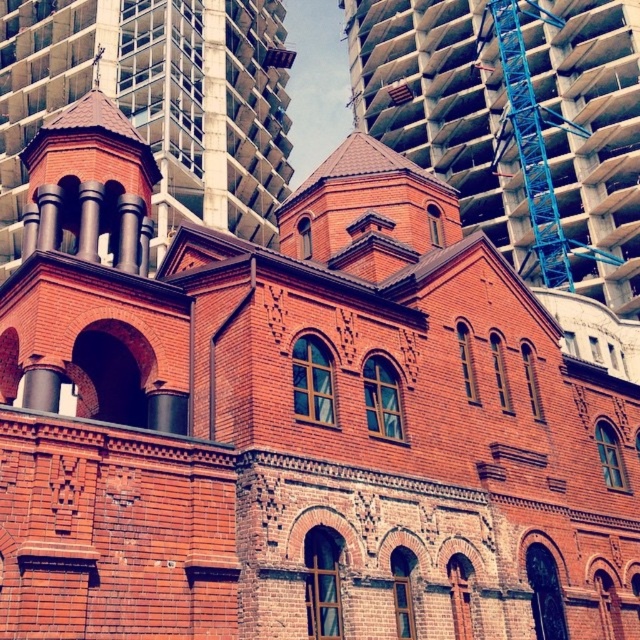
You are a construction worker planning to install a new flagpole on the roof of the red brick building at center. The flagpole needs to be 10 meters tall. Considering the height of the blue metallic crane at upper right, will the flagpole exceed the height of the crane?

The red brick building at center has a greater height compared to the blue metallic crane at upper right. Since the flagpole is to be installed on the already taller building, its total height would surpass the crane. Therefore, the flagpole will exceed the height of the blue metallic crane at upper right.

Consider the image. You are standing at the origin point in the image. Which direction should you move to reach the red brick building at center?

The red brick building at center is located at point 0.166 on the x axis and 0.689 on the y axis. Since you are at the origin, you should move right along the x axis and up along the y axis to reach it.

You are an architect analyzing the spatial arrangement of the scene. Based on the image, which object is positioned higher up in the composition between the red brick building at center and the red brick tower at upper left?

The red brick building at center is positioned higher up in the composition than the red brick tower at upper left.